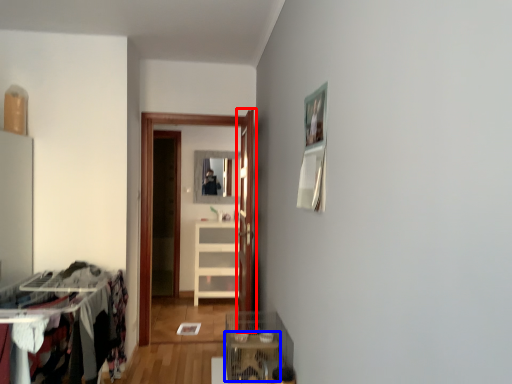
Question: Which of the following is the closest to the observer, door (highlighted by a red box) or table (highlighted by a blue box)?

Choices:
 (A) door
 (B) table

Answer: (B)